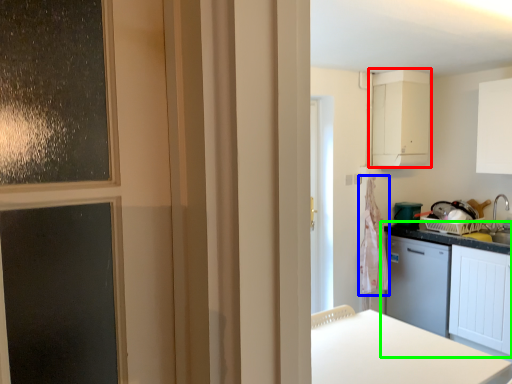
Question: Which object is positioned farthest from cabinetry (highlighted by a red box)? Select from laundry (highlighted by a blue box) and cabinetry (highlighted by a green box).

Choices:
 (A) laundry
 (B) cabinetry

Answer: (B)